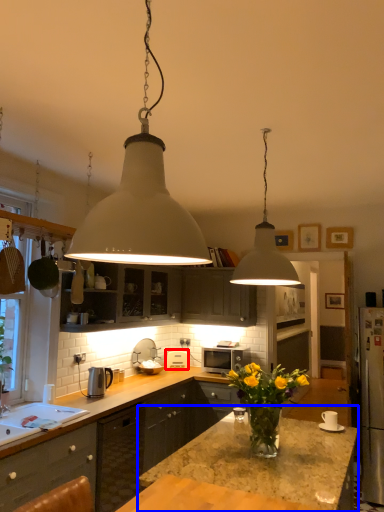
Question: Among these objects, which one is farthest to the camera, appliance (highlighted by a red box) or countertop (highlighted by a blue box)?

Choices:
 (A) appliance
 (B) countertop

Answer: (A)